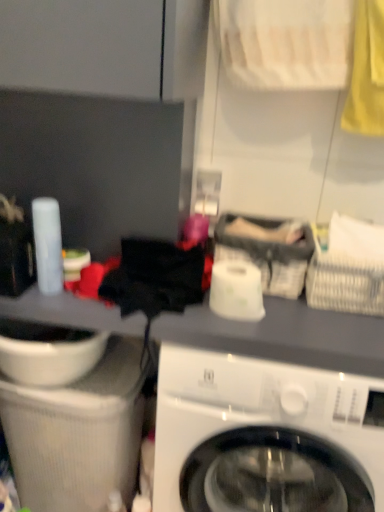
Question: In the image, is white glossy toilet paper at center on the left side or the right side of white glossy washing machine at center?

Choices:
 (A) right
 (B) left

Answer: (B)

Question: In terms of width, does white glossy toilet paper at center look wider or thinner when compared to white glossy washing machine at center?

Choices:
 (A) thin
 (B) wide

Answer: (A)

Question: Considering the real-world distances, which object is closest to the gray fabric basket at center, which ranks as the 1th basket in left-to-right order?

Choices:
 (A) white woven basket at upper right, the 2th basket from the left
 (B) white glossy washing machine at center
 (C) white glossy sink at lower left
 (D) white glossy toilet paper at center

Answer: (D)

Question: Which is nearer to the white glossy sink at lower left?

Choices:
 (A) gray fabric basket at center, the second basket when ordered from right to left
 (B) white woven basket at upper right, which is the first basket in right-to-left order
 (C) white glossy toilet paper at center
 (D) white glossy washing machine at center

Answer: (D)